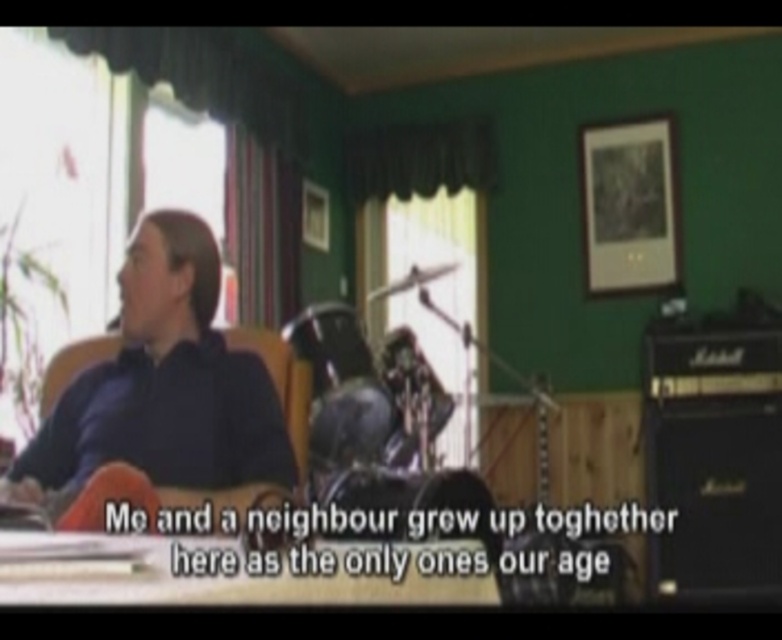
Question: From the image, what is the correct spatial relationship of black matte amplifier at lower right in relation to matte black chair at left?

Choices:
 (A) right
 (B) left

Answer: (A)

Question: Can you confirm if black matte amplifier at lower right is positioned to the left of matte black chair at left?

Choices:
 (A) no
 (B) yes

Answer: (A)

Question: Which object appears farthest from the camera in this image?

Choices:
 (A) matte black chair at left
 (B) black matte amplifier at lower right

Answer: (B)

Question: Which of the following is the farthest from the observer?

Choices:
 (A) matte black chair at left
 (B) black matte amplifier at lower right

Answer: (B)

Question: Which object is farther from the camera taking this photo?

Choices:
 (A) matte black chair at left
 (B) black matte amplifier at lower right

Answer: (B)

Question: Observing the image, what is the correct spatial positioning of black matte amplifier at lower right in reference to matte black chair at left?

Choices:
 (A) left
 (B) right

Answer: (B)